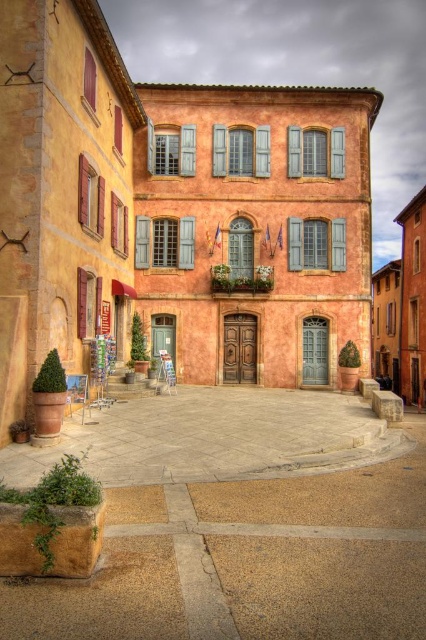
Question: Which point is closer to the camera taking this photo?

Choices:
 (A) (322, 611)
 (B) (267, 132)
 (C) (152, 131)
 (D) (221, 132)

Answer: (A)

Question: Is wooden shutters at center positioned behind wooden shutter at left?

Choices:
 (A) no
 (B) yes

Answer: (B)

Question: Which of the following is the farthest from the observer?

Choices:
 (A) (192, 609)
 (B) (293, 252)

Answer: (B)

Question: Is the position of wooden shutters at center more distant than that of matte wood shutter at left?

Choices:
 (A) no
 (B) yes

Answer: (B)

Question: Is blue wood shutter at center below wooden shutters at left?

Choices:
 (A) yes
 (B) no

Answer: (B)

Question: Which of the following is the closest to the observer?

Choices:
 (A) (261, 147)
 (B) (334, 257)
 (C) (216, 168)
 (D) (146, 252)

Answer: (B)